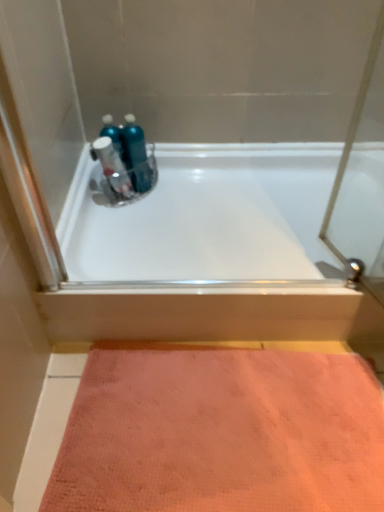
Image resolution: width=384 pixels, height=512 pixels. Identify the location of vacant area that is in front of metallic blue spray bottle at upper center. (120, 225).